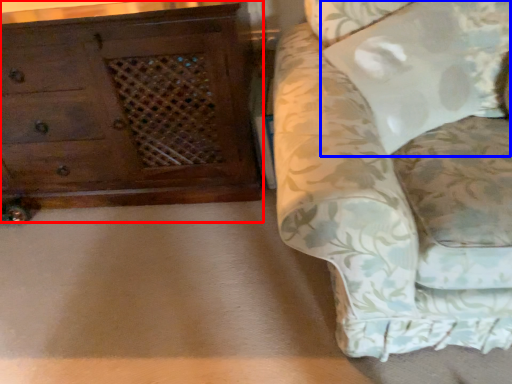
Question: Which object is closer to the camera taking this photo, chest of drawers (highlighted by a red box) or pillow (highlighted by a blue box)?

Choices:
 (A) chest of drawers
 (B) pillow

Answer: (B)